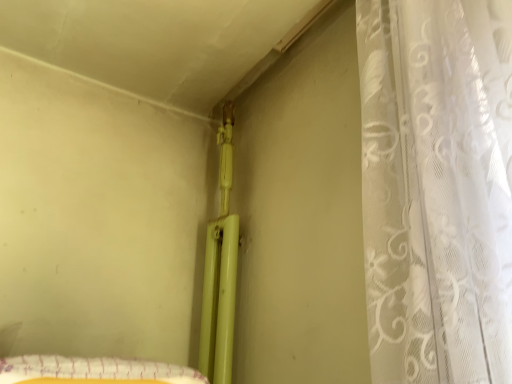
Question: From a real-world perspective, does white sheer curtain at right sit lower than yellow fabric at lower left?

Choices:
 (A) no
 (B) yes

Answer: (A)

Question: Is white sheer curtain at right placed right next to yellow fabric at lower left?

Choices:
 (A) no
 (B) yes

Answer: (A)

Question: Does white sheer curtain at right have a greater height compared to yellow fabric at lower left?

Choices:
 (A) yes
 (B) no

Answer: (A)

Question: From a real-world perspective, does white sheer curtain at right stand above yellow fabric at lower left?

Choices:
 (A) no
 (B) yes

Answer: (B)

Question: Does white sheer curtain at right come in front of yellow fabric at lower left?

Choices:
 (A) no
 (B) yes

Answer: (B)

Question: Is white sheer curtain at right far from yellow fabric at lower left?

Choices:
 (A) yes
 (B) no

Answer: (B)

Question: Is yellow fabric at lower left further to camera compared to white sheer curtain at right?

Choices:
 (A) yes
 (B) no

Answer: (A)

Question: Does yellow fabric at lower left have a lesser width compared to white sheer curtain at right?

Choices:
 (A) no
 (B) yes

Answer: (B)

Question: From the image's perspective, is yellow fabric at lower left beneath white sheer curtain at right?

Choices:
 (A) yes
 (B) no

Answer: (A)

Question: Is yellow fabric at lower left to the left of white sheer curtain at right from the viewer's perspective?

Choices:
 (A) yes
 (B) no

Answer: (A)

Question: Considering the relative sizes of yellow fabric at lower left and white sheer curtain at right in the image provided, is yellow fabric at lower left bigger than white sheer curtain at right?

Choices:
 (A) yes
 (B) no

Answer: (B)

Question: Does yellow fabric at lower left touch white sheer curtain at right?

Choices:
 (A) yes
 (B) no

Answer: (B)

Question: In the image, is white sheer curtain at right on the left side or the right side of yellow fabric at lower left?

Choices:
 (A) right
 (B) left

Answer: (A)